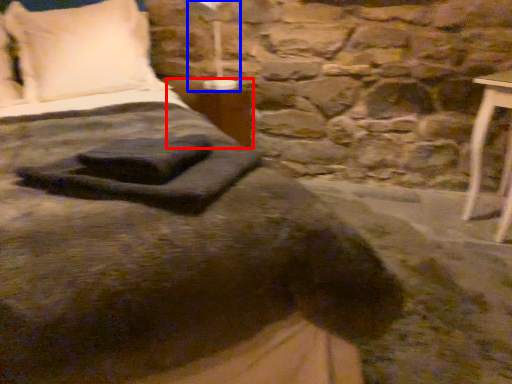
Question: Which object appears farthest to the camera in this image, table (highlighted by a red box) or bedside lamp (highlighted by a blue box)?

Choices:
 (A) table
 (B) bedside lamp

Answer: (A)